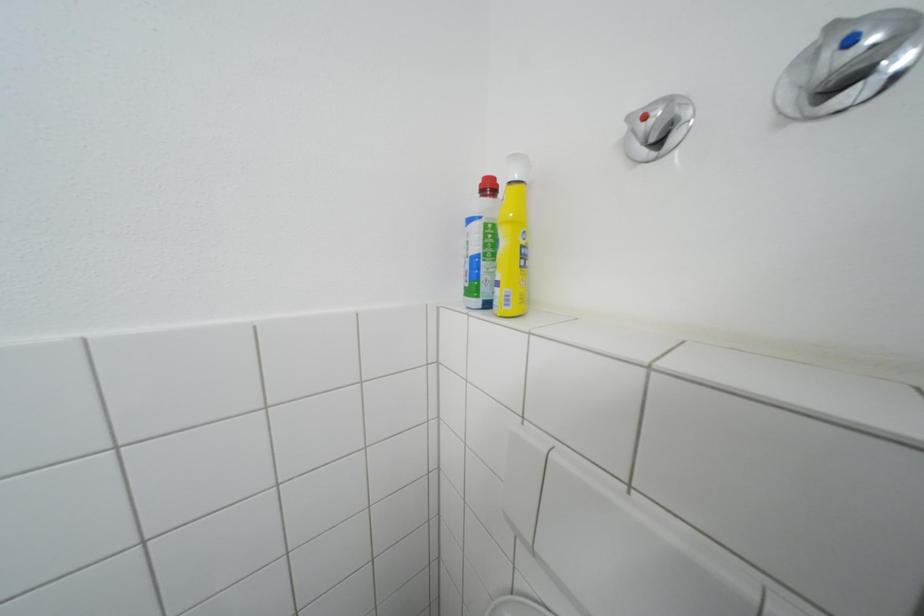
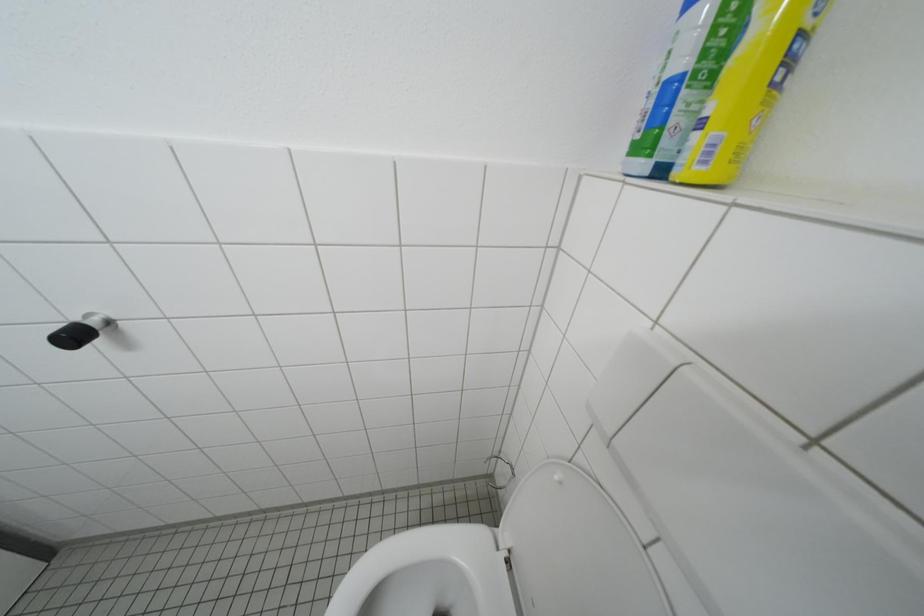
First-person continuous shooting, in which direction is the camera rotating?

The camera rotated toward left-down.